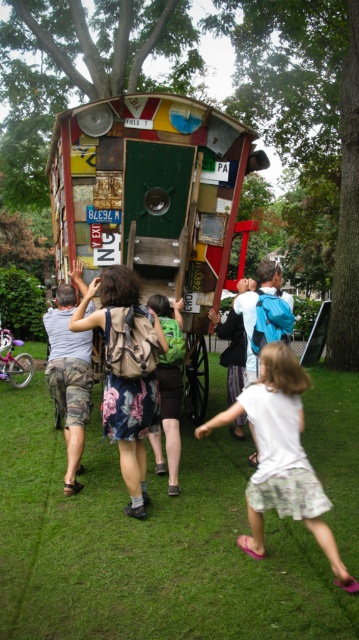
Who is higher up, green grass at lower center or green backpack at center?

green backpack at center

What do you see at coordinates (147, 545) in the screenshot?
I see `green grass at lower center` at bounding box center [147, 545].

This screenshot has height=640, width=359. What do you see at coordinates (147, 545) in the screenshot?
I see `green grass at lower center` at bounding box center [147, 545].

What are the coordinates of `green grass at lower center` in the screenshot? It's located at (147, 545).

This screenshot has width=359, height=640. What are the coordinates of `multicolored wooden wagon at center` in the screenshot? It's located at (154, 202).

Does multicolored wooden wagon at center lie behind white cotton shirt at lower right?

Yes, it is.

Is point (152, 163) farther from camera compared to point (305, 465)?

Yes, it is behind point (305, 465).

Where is `multicolored wooden wagon at center`? Image resolution: width=359 pixels, height=640 pixels. multicolored wooden wagon at center is located at coordinates (154, 202).

Does green grass at lower center have a larger size compared to white cotton shirt at lower right?

Incorrect, green grass at lower center is not larger than white cotton shirt at lower right.

Does point (348, 458) lie in front of point (268, 452)?

No, it is not.

Locate an element on the screen. green grass at lower center is located at coordinates (147, 545).